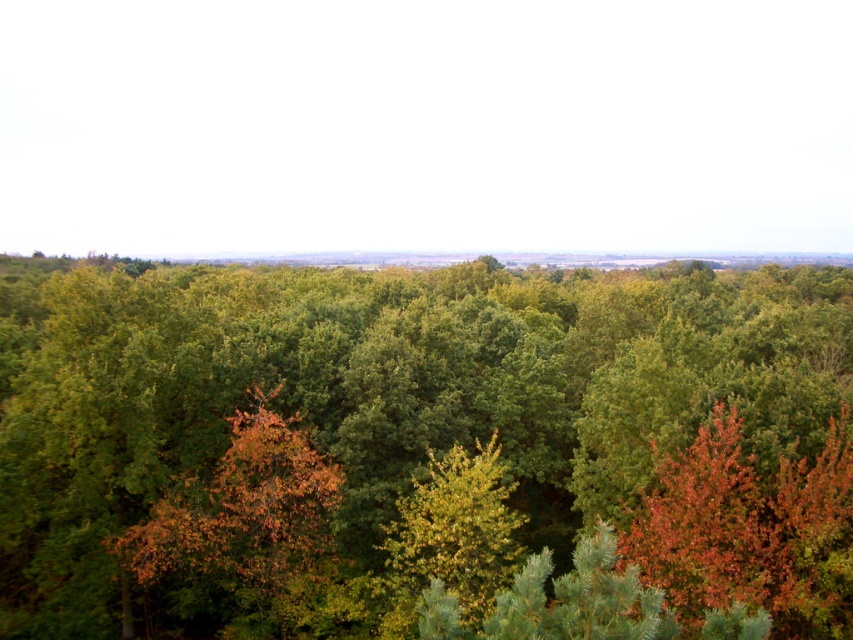
Is green leafy forest at center positioned in front of orange leafy tree at center?

Yes, it is in front of orange leafy tree at center.

Which is more to the left, green leafy forest at center or orange leafy tree at center?

green leafy forest at center

Measure the distance between point (485,554) and camera.

Point (485,554) is 27.83 meters from camera.

Locate an element on the screen. The image size is (853, 640). green leafy forest at center is located at coordinates (415, 444).